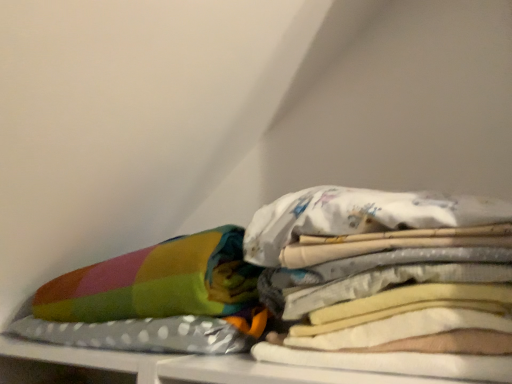
Question: Is multicolored fabric pillow at left at the back of white fabric at center?

Choices:
 (A) yes
 (B) no

Answer: (B)

Question: Is white fabric at center at the left side of multicolored fabric pillow at left?

Choices:
 (A) yes
 (B) no

Answer: (B)

Question: Is white fabric at center next to multicolored fabric pillow at left?

Choices:
 (A) no
 (B) yes

Answer: (A)

Question: Considering the relative positions of white fabric at center and multicolored fabric pillow at left in the image provided, is white fabric at center in front of multicolored fabric pillow at left?

Choices:
 (A) yes
 (B) no

Answer: (A)

Question: Can you confirm if white fabric at center is wider than multicolored fabric pillow at left?

Choices:
 (A) no
 (B) yes

Answer: (A)

Question: Considering the relative sizes of white fabric at center and multicolored fabric pillow at left in the image provided, is white fabric at center thinner than multicolored fabric pillow at left?

Choices:
 (A) yes
 (B) no

Answer: (A)

Question: Does multicolored fabric pillow at left have a smaller size compared to white fabric at center?

Choices:
 (A) no
 (B) yes

Answer: (A)

Question: Is multicolored fabric pillow at left next to white fabric at center and touching it?

Choices:
 (A) no
 (B) yes

Answer: (A)

Question: Is multicolored fabric pillow at left oriented towards white fabric at center?

Choices:
 (A) no
 (B) yes

Answer: (A)

Question: Is multicolored fabric pillow at left oriented away from white fabric at center?

Choices:
 (A) no
 (B) yes

Answer: (A)

Question: From the image's perspective, is multicolored fabric pillow at left under white fabric at center?

Choices:
 (A) yes
 (B) no

Answer: (A)

Question: Is multicolored fabric pillow at left at the right side of white fabric at center?

Choices:
 (A) no
 (B) yes

Answer: (A)

Question: Looking at their shapes, would you say multicolored fabric pillow at left is wider or thinner than white fabric at center?

Choices:
 (A) thin
 (B) wide

Answer: (B)